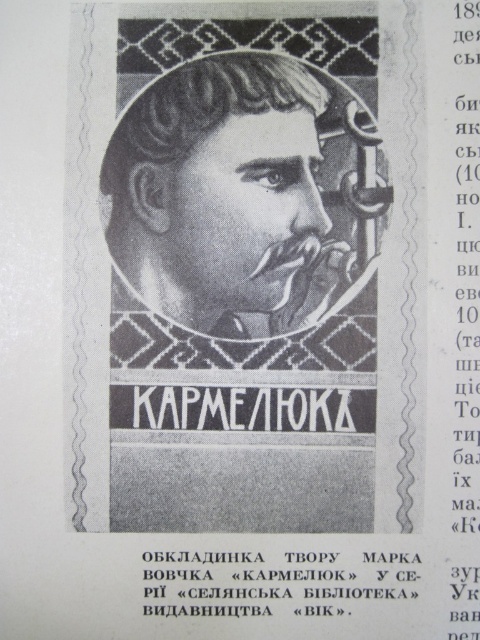
Looking at the scanned page, you see the gray pencil sketch of man at center and the black paper text at upper center. Which object is positioned to the right?

The black paper text at upper center is to the right of the gray pencil sketch of man at center.